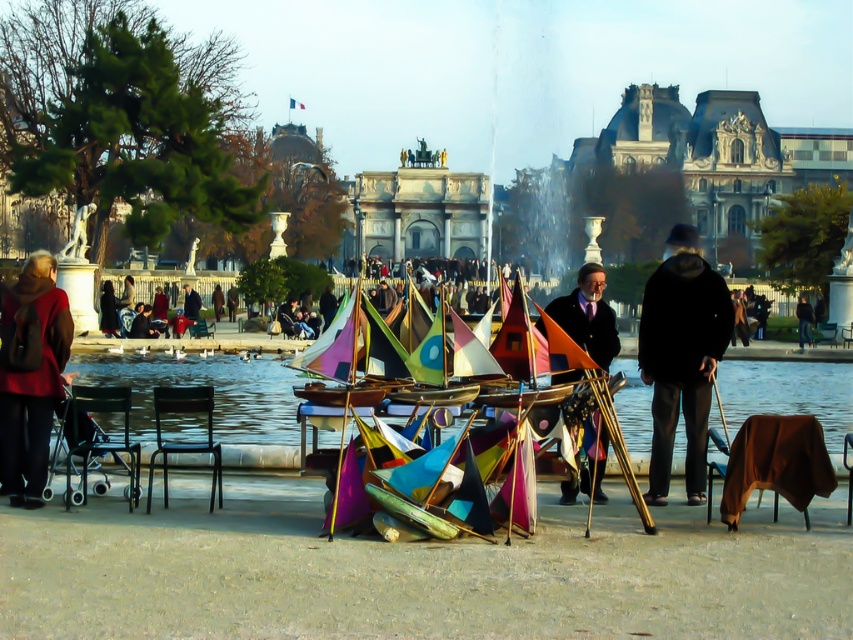
You are a photographer trying to capture a clear shot of the black leather jacket at center without the matte black coat at center blocking it. What adjustment should you make to your camera angle?

The matte black coat at center is above the black leather jacket at center, so lowering the camera angle would allow you to capture the black leather jacket at center without obstruction.

You are a photographer trying to capture both the matte red coat at left and the black leather jacket at center in a single shot. Based on their positions, which one would naturally be in focus if you focus on the foreground?

The matte red coat at left would naturally be in focus because it is positioned closer to the foreground than the black leather jacket at center.